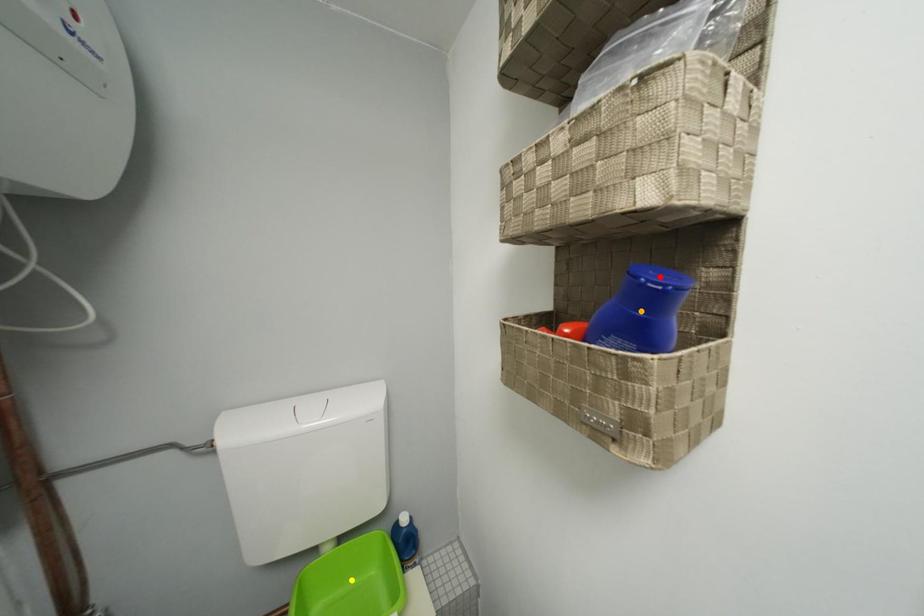
Order these from nearest to farthest:
orange point | yellow point | red point

red point
orange point
yellow point